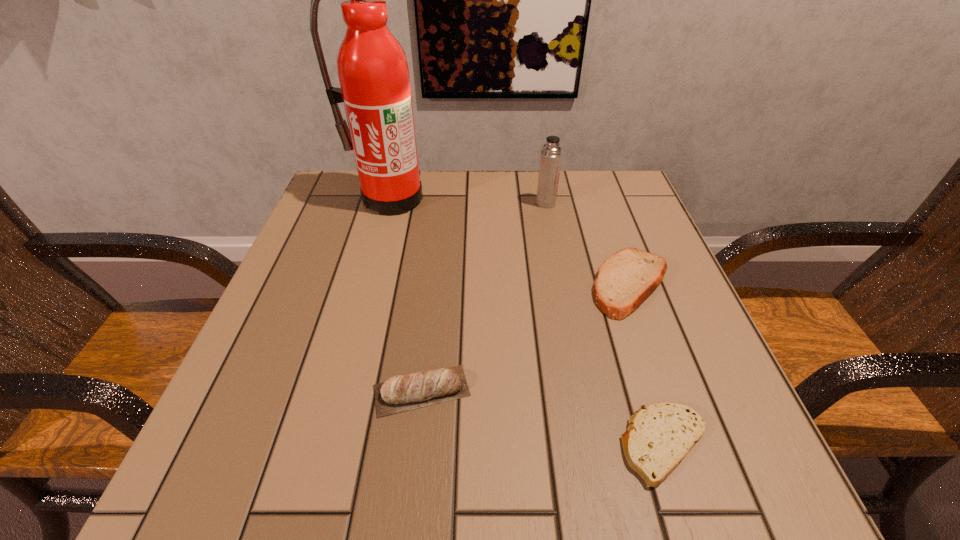
This screenshot has height=540, width=960. What are the coordinates of `free space located 0.070m on the back of the shortest pita bread` in the screenshot? It's located at (640, 367).

Locate an element on the screen. This screenshot has width=960, height=540. fire extinguisher at the far edge is located at coordinates (373, 73).

This screenshot has height=540, width=960. I want to click on thermos bottle that is positioned at the far edge, so click(x=551, y=156).

Locate an element on the screen. object at the near edge is located at coordinates (660, 435).

The image size is (960, 540). What are the coordinates of `object located at the left edge` in the screenshot? It's located at (373, 73).

At what (x,y) coordinates should I click in order to perform the action: click on object located at the far left corner. Please return your answer as a coordinate pair (x, y). Image resolution: width=960 pixels, height=540 pixels. Looking at the image, I should click on (373, 73).

This screenshot has width=960, height=540. In order to click on object that is at the near right corner in this screenshot , I will do `click(660, 435)`.

Where is `vacant space at the far edge of the desktop`? The width and height of the screenshot is (960, 540). vacant space at the far edge of the desktop is located at coordinates (564, 197).

In the image, there is a desktop. Where is `vacant space at the near edge`? The image size is (960, 540). vacant space at the near edge is located at coordinates (459, 472).

You are a GUI agent. You are given a task and a screenshot of the screen. Output one action in this format:
    pyautogui.click(x=<x>, y=<y>)
    Task: Click on the blank space at the left edge of the desktop
    
    Given the screenshot: What is the action you would take?
    pyautogui.click(x=282, y=407)